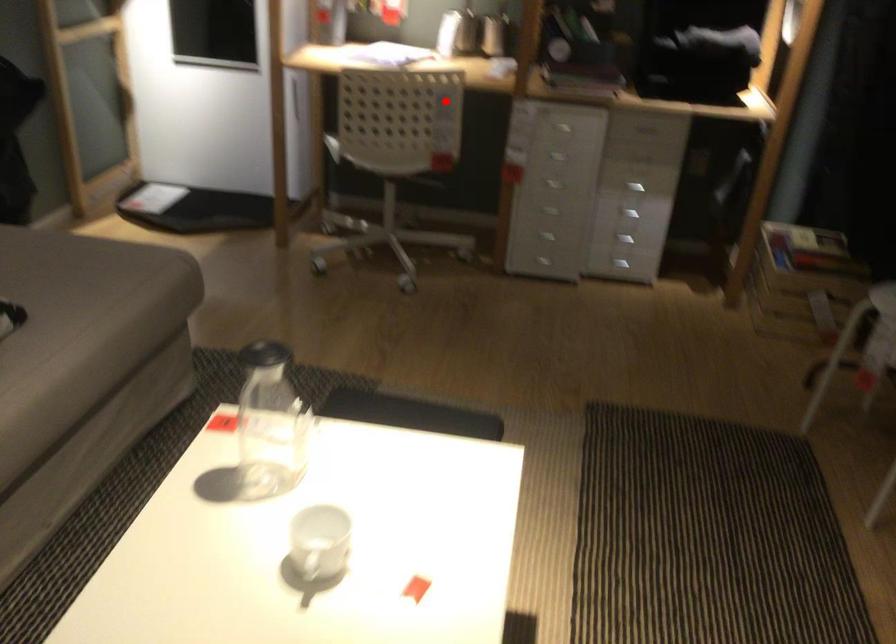
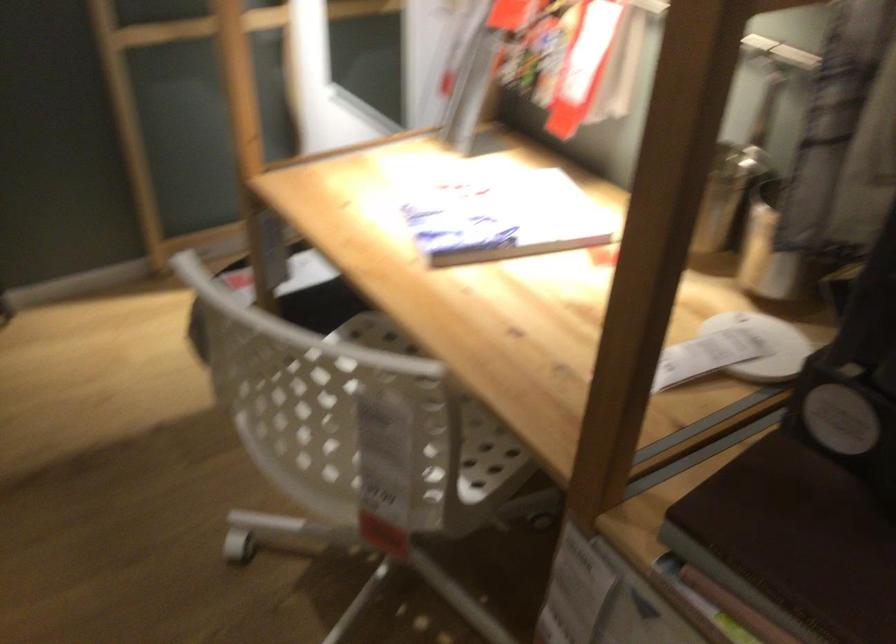
Question: I am providing you with two images of the same scene from different viewpoints. A red point is shown in image1. For the corresponding object point in image2, is it positioned nearer or farther from the camera?

Choices:
 (A) Nearer
 (B) Farther

Answer: (A)